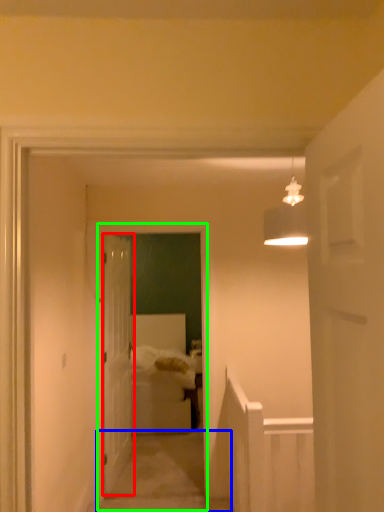
Question: Which is nearer to the door (highlighted by a red box)? path (highlighted by a blue box) or corridor (highlighted by a green box).

Choices:
 (A) path
 (B) corridor

Answer: (B)